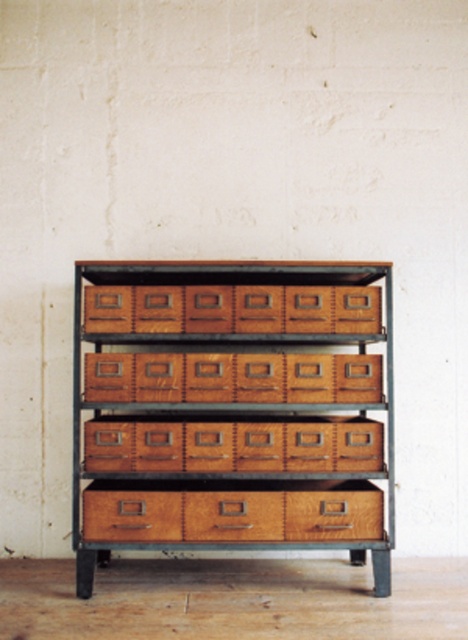
From the picture: You are standing in front of a multi tiered storage unit with four shelves. You see a natural wood drawer at lower center. Can you determine its exact position using coordinates?

The natural wood drawer at lower center is located at point (232, 512).

You are organizing files in a storage unit and need to place a new folder between the natural wood drawer at center and the brown wood drawer at center. Which drawer should you place the folder in front of or behind?

You should place the new folder behind the natural wood drawer at center since it is closer to you than the brown wood drawer at center.

You are standing in front of the storage unit. Where exactly are the wooden drawers at center located in terms of coordinates?

The wooden drawers at center are located at point coordinates of [231,385].